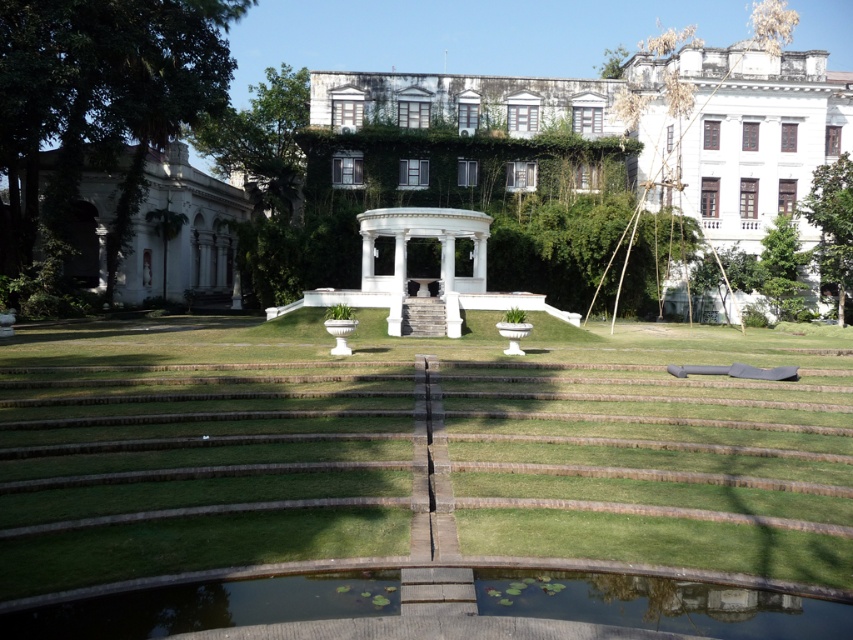
Which is more to the right, green smooth water at lower center or white marble mansion at left?

Positioned to the right is green smooth water at lower center.

Locate an element on the screen. This screenshot has width=853, height=640. green smooth water at lower center is located at coordinates (659, 604).

Identify the location of green smooth water at lower center. The height and width of the screenshot is (640, 853). (659, 604).

Can you confirm if white marble mansion at left is taller than white marble gazebo at center?

Indeed, white marble mansion at left has a greater height compared to white marble gazebo at center.

You are a GUI agent. You are given a task and a screenshot of the screen. Output one action in this format:
    pyautogui.click(x=<x>, y=<y>)
    Task: Click on the white marble mansion at left
    The height and width of the screenshot is (640, 853).
    Given the screenshot: What is the action you would take?
    pyautogui.click(x=181, y=234)

At what (x,y) coordinates should I click in order to perform the action: click on white marble mansion at left. Please return your answer as a coordinate pair (x, y). This screenshot has width=853, height=640. Looking at the image, I should click on (181, 234).

Is point (225, 348) more distant than point (90, 241)?

No, it is in front of (90, 241).

Which is behind, point (61, 435) or point (233, 278)?

Point (233, 278)

Between point (579, 470) and point (202, 228), which one is positioned in front?

Positioned in front is point (579, 470).

I want to click on green grass at center, so click(x=413, y=448).